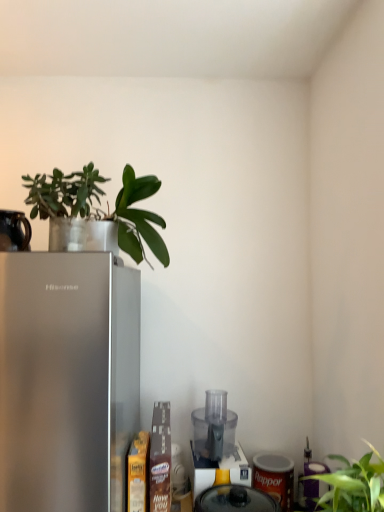
Question: From a real-world perspective, relative to transparent plastic food processor at lower center, the 2th appliance ordered from the bottom, is black ceramic mug at upper left, acting as the third appliance starting from the bottom, vertically above or below?

Choices:
 (A) above
 (B) below

Answer: (A)

Question: From the image's perspective, relative to transparent plastic food processor at lower center, positioned as the second appliance in top-to-bottom order, is black ceramic mug at upper left, placed as the first appliance when sorted from front to back, above or below?

Choices:
 (A) above
 (B) below

Answer: (A)

Question: Which is nearer to the green matte leafy plant at upper left, the 2th plant viewed from the left?

Choices:
 (A) green matte plant at upper left, the first plant when ordered from left to right
 (B) transparent plastic blender at center
 (C) translucent plastic food processor at center, the first appliance when ordered from right to left
 (D) black ceramic mug at upper left, which ranks as the first appliance in left-to-right order
 (E) transparent plastic food processor at lower center, the 2th appliance ordered from the bottom

Answer: (A)

Question: Which is nearer to the green matte leafy plant at upper left, the 2th plant viewed from the left?

Choices:
 (A) transparent plastic blender at center
 (B) satin silver refrigerator at left
 (C) green matte plant at upper left, the 2th plant in the right-to-left sequence
 (D) black ceramic mug at upper left, arranged as the third appliance when viewed from the back
 (E) transparent plastic food processor at lower center, arranged as the second appliance when viewed from the left

Answer: (C)